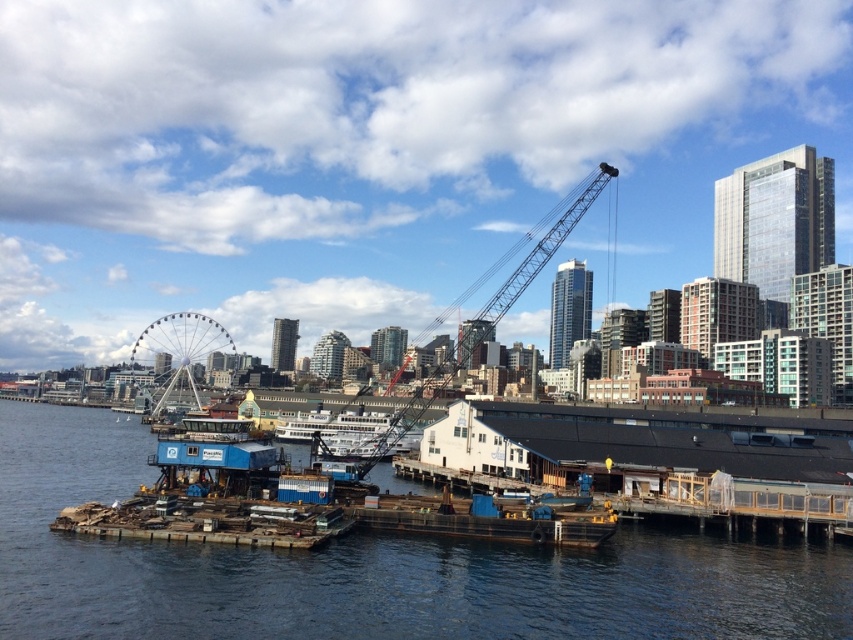
Question: Among these objects, which one is farthest from the camera?

Choices:
 (A) white metallic ferris wheel at left
 (B) white matte ferry at center
 (C) metallic gray crane at center
 (D) brown wooden dock at center

Answer: (A)

Question: Is metallic gray crane at center thinner than white metallic ferris wheel at left?

Choices:
 (A) yes
 (B) no

Answer: (B)

Question: Does metallic gray crane at center appear over white metallic ferris wheel at left?

Choices:
 (A) no
 (B) yes

Answer: (B)

Question: Which of the following is the closest to the observer?

Choices:
 (A) brown wooden dock at center
 (B) white matte ferry at center

Answer: (A)

Question: Is white metallic ferris wheel at left above white matte ferry at center?

Choices:
 (A) no
 (B) yes

Answer: (B)

Question: Among these points, which one is nearest to the camera?

Choices:
 (A) (352, 416)
 (B) (347, 605)
 (C) (129, 364)

Answer: (B)